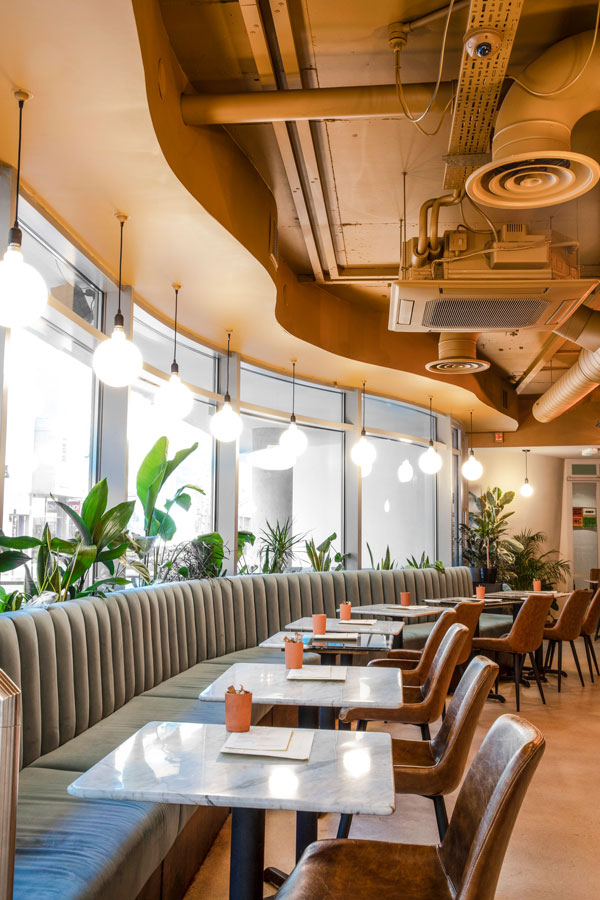
Locate an element on the screen. vertical window dividers with glass on either side is located at coordinates (445, 516), (355, 515), (230, 509), (118, 481).